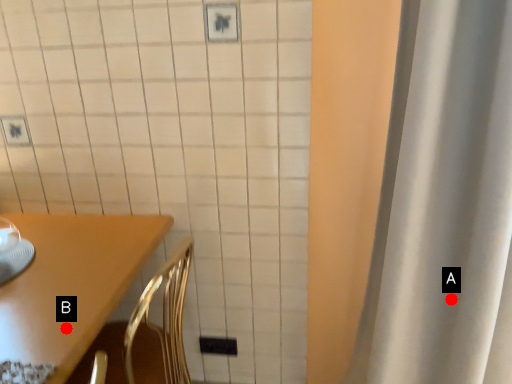
Question: Two points are circled on the image, labeled by A and B beside each circle. Which point is farther to the camera?

Choices:
 (A) A is further
 (B) B is further

Answer: (A)